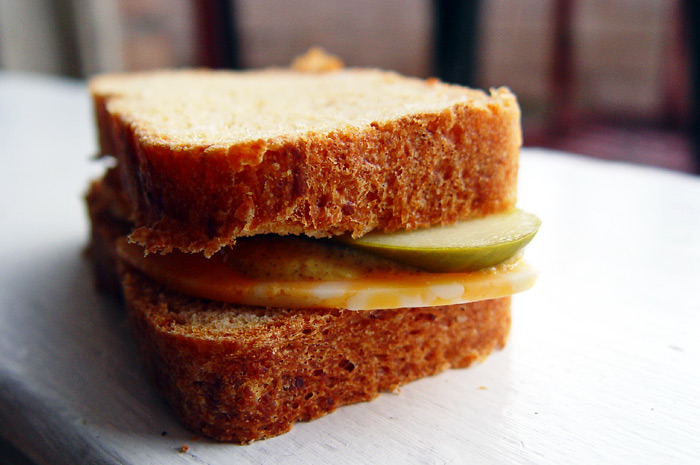
At what (x,y) coordinates should I click in order to perform the action: click on chair. Please return your answer as a coordinate pair (x, y). This screenshot has width=700, height=465. Looking at the image, I should click on (556, 59).